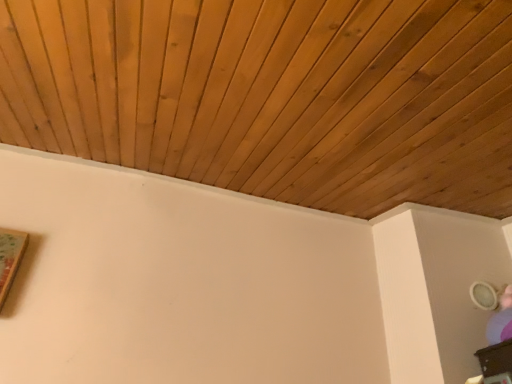
Identify the location of wooden frame at lower left. (10, 258).

What do you see at coordinates (10, 258) in the screenshot?
I see `wooden frame at lower left` at bounding box center [10, 258].

In order to face wooden frame at lower left, should I rotate leftwards or rightwards?

It's best to rotate left around 33.140 degrees.

You are a GUI agent. You are given a task and a screenshot of the screen. Output one action in this format:
    pyautogui.click(x=<x>, y=<y>)
    Task: Click on the wooden frame at lower left
    Image resolution: width=512 pixels, height=384 pixels.
    Given the screenshot: What is the action you would take?
    pyautogui.click(x=10, y=258)